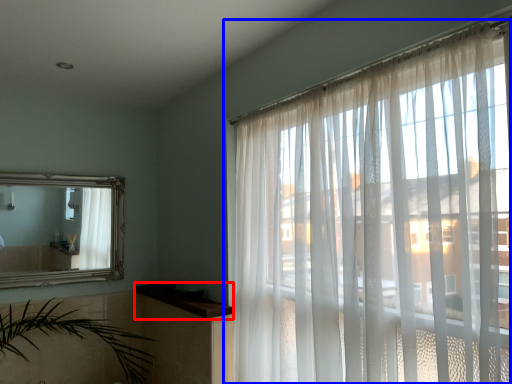
Question: Which of the following is the farthest to the observer, window sill (highlighted by a red box) or window (highlighted by a blue box)?

Choices:
 (A) window sill
 (B) window

Answer: (A)